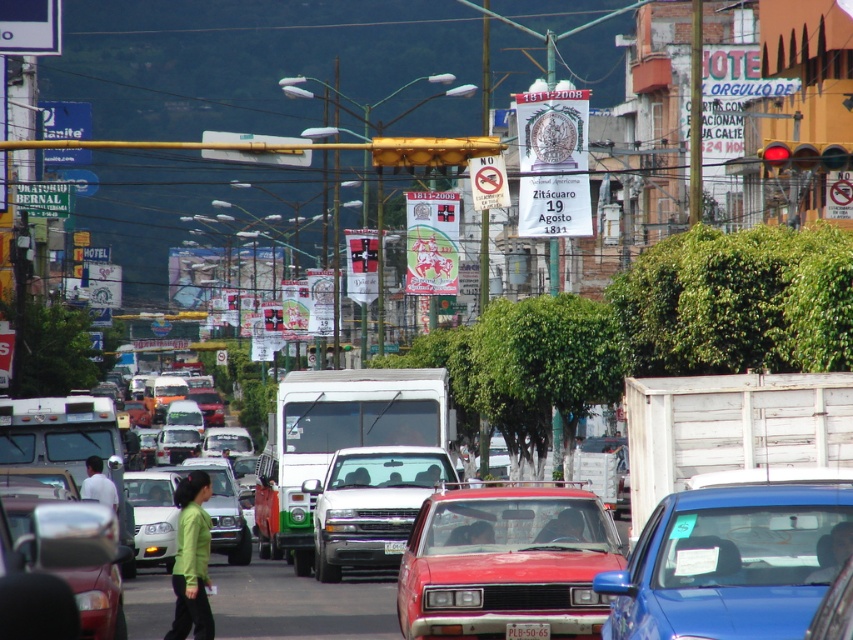
You are standing on the busy urban street and want to walk from the point at coordinates (514,632) to the point at (390,552). Which direction should you face to move towards the second point?

You should face towards the direction away from the viewer because point (390,552) is further away than point (514,632).

You are a photographer standing on the sidewalk of this busy street. You notice a green matte shirt at center and a white plastic license plate at center in your viewfinder. Which object should you zoom in on to capture more details of the taller one?

The green matte shirt at center is much taller than the white plastic license plate at center, so you should zoom in on the green matte shirt at center to capture more details of the taller one.

Consider the image. You are a photographer trying to capture a clear shot of the green matte shirt at center and the white plastic license plate at center in the busy street scene. Which object should you zoom in on to ensure it takes up more space in your photo?

The white plastic license plate at center is larger than the green matte shirt at center, so you should zoom in on the white plastic license plate at center to ensure it takes up more space in your photo.